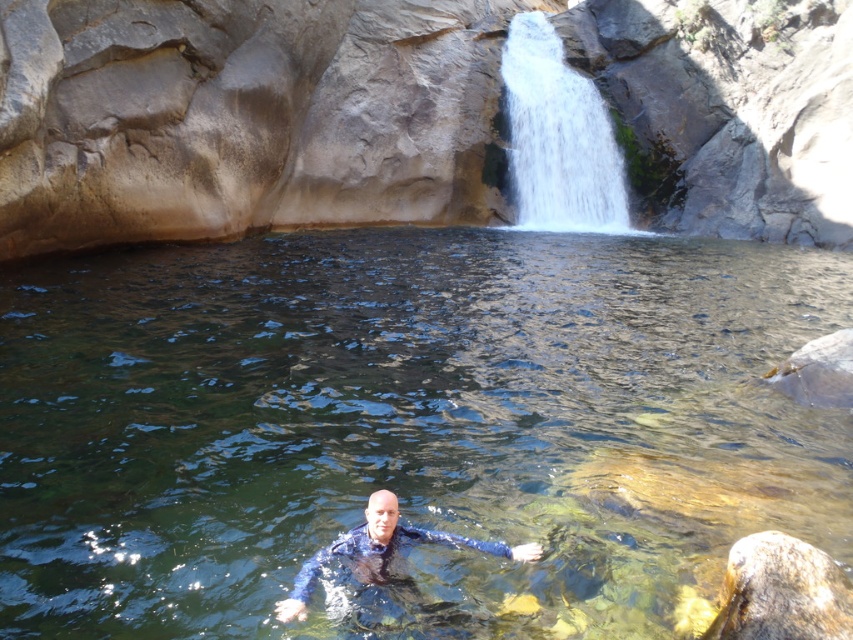
You are a swimmer trying to reach the clear water at center. You are currently at point (390,420). Is the point you are at on the clear water at center?

Yes, the point (390,420) is on the clear water at center.